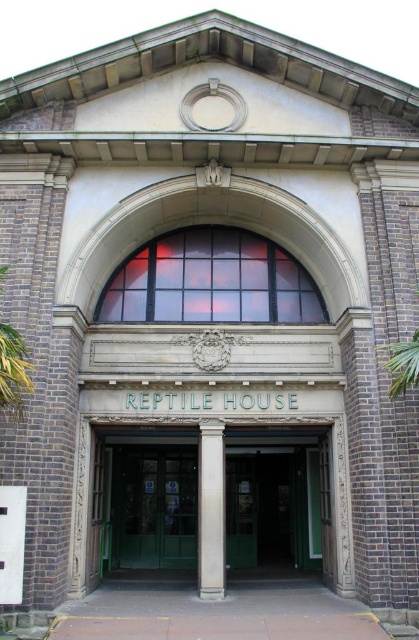
Is point (110, 513) closer to viewer compared to point (207, 572)?

No, (110, 513) is behind (207, 572).

Which is more to the right, green glass door at center or white stone column at center?

From the viewer's perspective, white stone column at center appears more on the right side.

Which is behind, point (168, 561) or point (216, 492)?

Positioned behind is point (168, 561).

At what (x,y) coordinates should I click in order to perform the action: click on green glass door at center. Please return your answer as a coordinate pair (x, y). The width and height of the screenshot is (419, 640). Looking at the image, I should click on (154, 508).